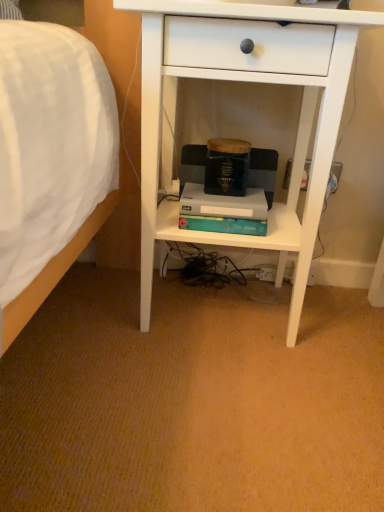
Find the location of a particular element. free space above teal matte paperback book at center (from a real-world perspective) is located at coordinates (218, 193).